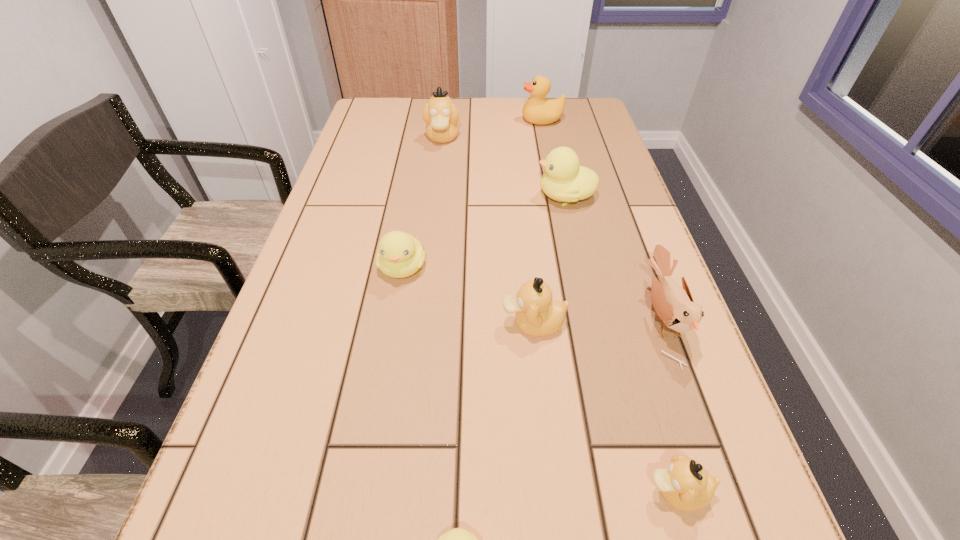
In order to click on the biggest tan duckling in this screenshot , I will do `click(441, 116)`.

Identify the location of the farthest duckling. pyautogui.click(x=441, y=116).

This screenshot has height=540, width=960. What are the coordinates of `duck` in the screenshot? It's located at (538, 110).

At what (x,y) coordinates should I click in order to perform the action: click on the sixth nearest object. Please return your answer as a coordinate pair (x, y). This screenshot has height=540, width=960. Looking at the image, I should click on (564, 180).

You are a GUI agent. You are given a task and a screenshot of the screen. Output one action in this format:
    pyautogui.click(x=<x>, y=<y>)
    Task: Click on the fifth nearest duckling
    
    Given the screenshot: What is the action you would take?
    pyautogui.click(x=564, y=180)

Find the location of a particular element. the second tan duckling from right to left is located at coordinates [537, 314].

Identify the location of the second smallest tan duckling. The image size is (960, 540). (537, 314).

I want to click on bird, so 674,305.

I want to click on the second smallest yellow duckling, so click(399, 255).

At what (x,y) coordinates should I click in order to perform the action: click on the leftmost yellow duckling. Please return your answer as a coordinate pair (x, y). The width and height of the screenshot is (960, 540). Looking at the image, I should click on (399, 255).